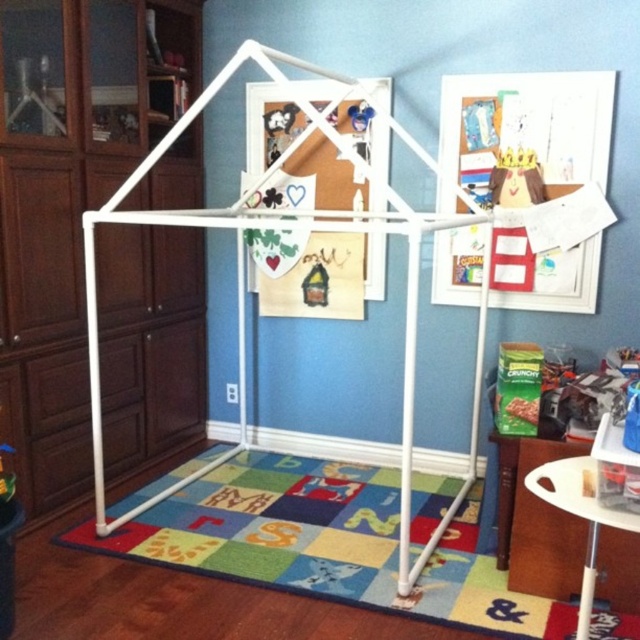
You are a child trying to reach the matte plastic toy at center and the matte cardboard picture frame at center. Which object is closer to the floor?

The matte cardboard picture frame at center is located below the matte plastic toy at center, so it is closer to the floor than the matte plastic toy at center.

You are a child trying to reach both the matte cardboard picture frame at center and the matte plastic toy at center from your current position. Which one is closer to you?

Both the matte cardboard picture frame at center and the matte plastic toy at center are at the same distance from you since they are both at the center of the scene.

You are a parent trying to place a new drawing on the matte cardboard picture frame at center. You also have a white plastic stool at lower right nearby. Can the stool fit under the frame without overlapping it?

The matte cardboard picture frame at center is wider than the white plastic stool at lower right. Since the stool is narrower, it can fit under the frame without overlapping.